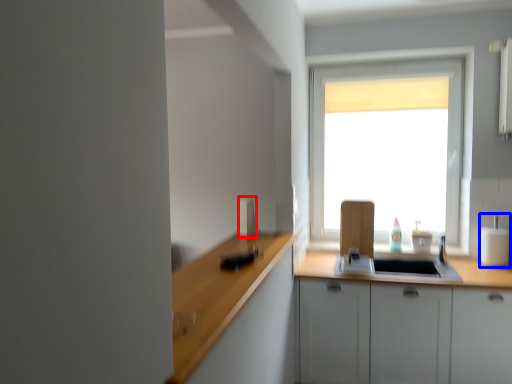
Question: Which of the following is the farthest to the observer, appliance (highlighted by a red box) or appliance (highlighted by a blue box)?

Choices:
 (A) appliance
 (B) appliance

Answer: (B)